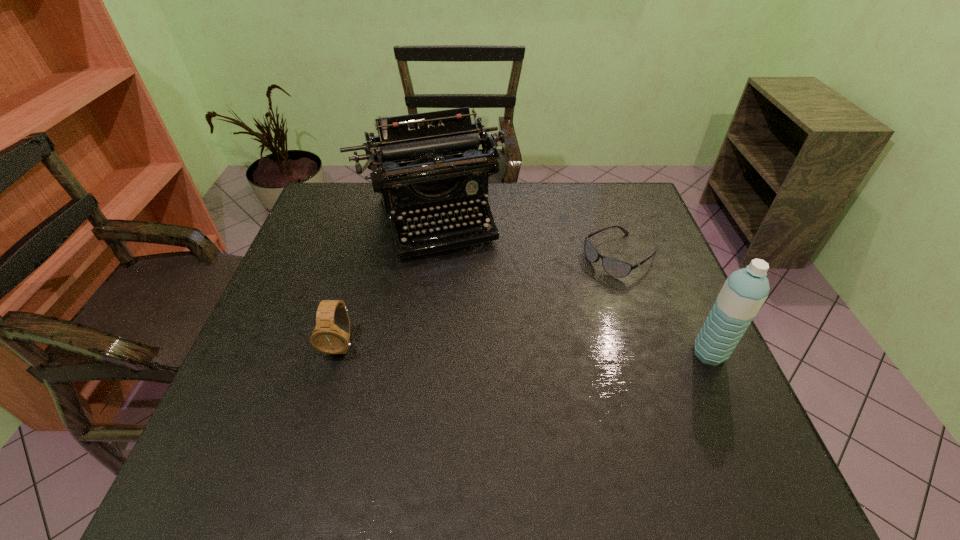
Locate an element on the screen. The width and height of the screenshot is (960, 540). vacant space situated on the keyboard of the typewriter is located at coordinates (477, 345).

Where is `free space located on the keyboard of the typewriter`? The height and width of the screenshot is (540, 960). free space located on the keyboard of the typewriter is located at coordinates (485, 366).

I want to click on object that is at the far edge, so click(430, 160).

I want to click on object located in the left edge section of the desktop, so click(x=430, y=160).

Locate an element on the screen. The image size is (960, 540). water bottle that is at the right edge is located at coordinates (744, 292).

This screenshot has height=540, width=960. Identify the location of sunglasses at the right edge. (613, 267).

At what (x,y) coordinates should I click in order to perform the action: click on object located at the far left corner. Please return your answer as a coordinate pair (x, y). Looking at the image, I should click on (430, 160).

Image resolution: width=960 pixels, height=540 pixels. I want to click on vacant space at the far edge of the desktop, so click(x=529, y=184).

Identify the location of vacant space at the near edge of the desktop. (308, 431).

You are a GUI agent. You are given a task and a screenshot of the screen. Output one action in this format:
    pyautogui.click(x=<x>, y=<y>)
    Task: Click on the free space at the left edge of the desktop
    The width and height of the screenshot is (960, 540).
    Given the screenshot: What is the action you would take?
    256,346